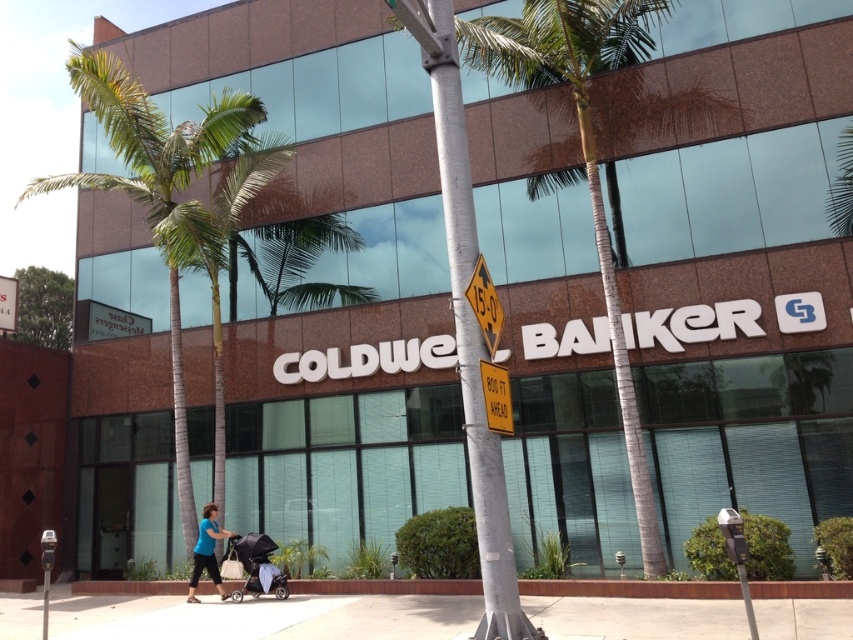
Does white painted metal pole at center have a greater height compared to black fabric stroller at lower center?

Correct, white painted metal pole at center is much taller as black fabric stroller at lower center.

Between white painted metal pole at center and black fabric stroller at lower center, which one is positioned higher?

white painted metal pole at center is above.

Describe the element at coordinates (468, 320) in the screenshot. I see `white painted metal pole at center` at that location.

The image size is (853, 640). I want to click on white painted metal pole at center, so click(x=468, y=320).

Where is `green leafy palm tree at left`? green leafy palm tree at left is located at coordinates (165, 189).

Can you confirm if green leafy palm tree at left is thinner than yellow plastic sign at center?

In fact, green leafy palm tree at left might be wider than yellow plastic sign at center.

Is point (111, 70) positioned in front of point (486, 417)?

No, (111, 70) is behind (486, 417).

The height and width of the screenshot is (640, 853). Find the location of `green leafy palm tree at left`. green leafy palm tree at left is located at coordinates (165, 189).

Does concrete at center appear on the right side of green leafy palm tree at center?

Incorrect, concrete at center is not on the right side of green leafy palm tree at center.

Which is above, concrete at center or green leafy palm tree at center?

green leafy palm tree at center is above.

Find the location of `concrete at center`. concrete at center is located at coordinates (264, 618).